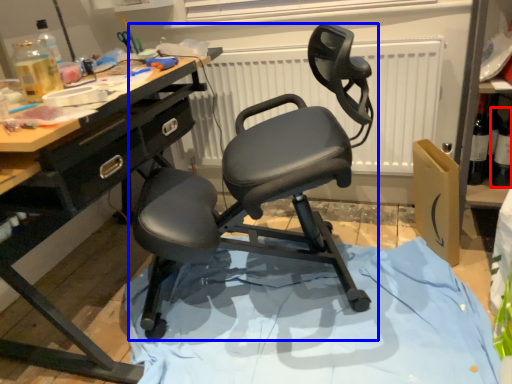
Question: Among these objects, which one is farthest to the camera, bottle (highlighted by a red box) or chair (highlighted by a blue box)?

Choices:
 (A) bottle
 (B) chair

Answer: (A)